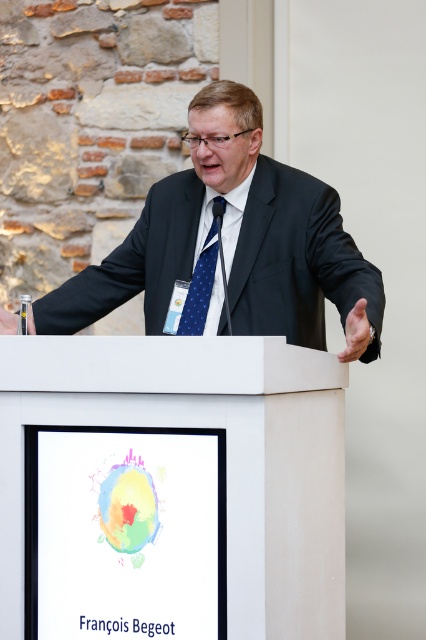
Question: Does white matte podium at center appear over black suit at center?

Choices:
 (A) yes
 (B) no

Answer: (B)

Question: Which object is farther from the camera taking this photo?

Choices:
 (A) black suit at center
 (B) blue dotted fabric tie at center
 (C) white matte podium at center

Answer: (B)

Question: Where is black suit at center located in relation to blue dotted fabric tie at center in the image?

Choices:
 (A) above
 (B) below

Answer: (B)

Question: Does white matte podium at center have a lesser width compared to black suit at center?

Choices:
 (A) no
 (B) yes

Answer: (B)

Question: Which object is the closest to the blue dotted fabric tie at center?

Choices:
 (A) white matte podium at center
 (B) black suit at center

Answer: (B)

Question: Which object appears farthest from the camera in this image?

Choices:
 (A) black suit at center
 (B) blue dotted fabric tie at center

Answer: (B)